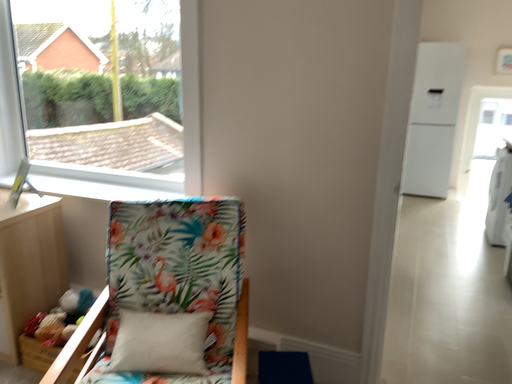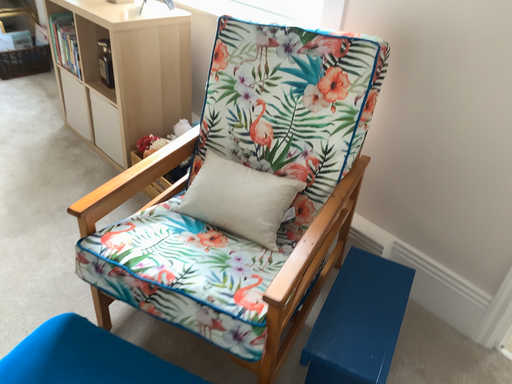
Question: Which way did the camera rotate in the video?

Choices:
 (A) rotated right
 (B) rotated left

Answer: (B)